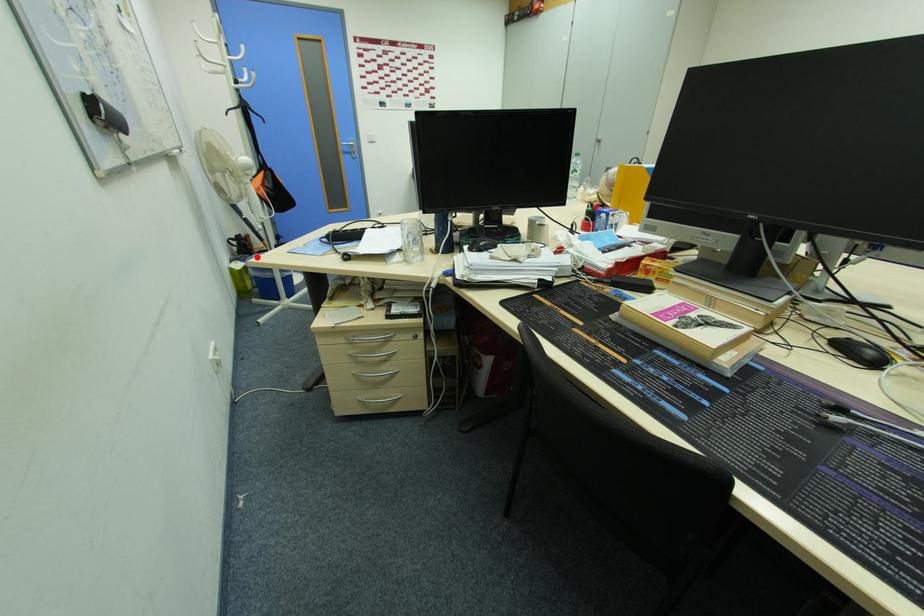
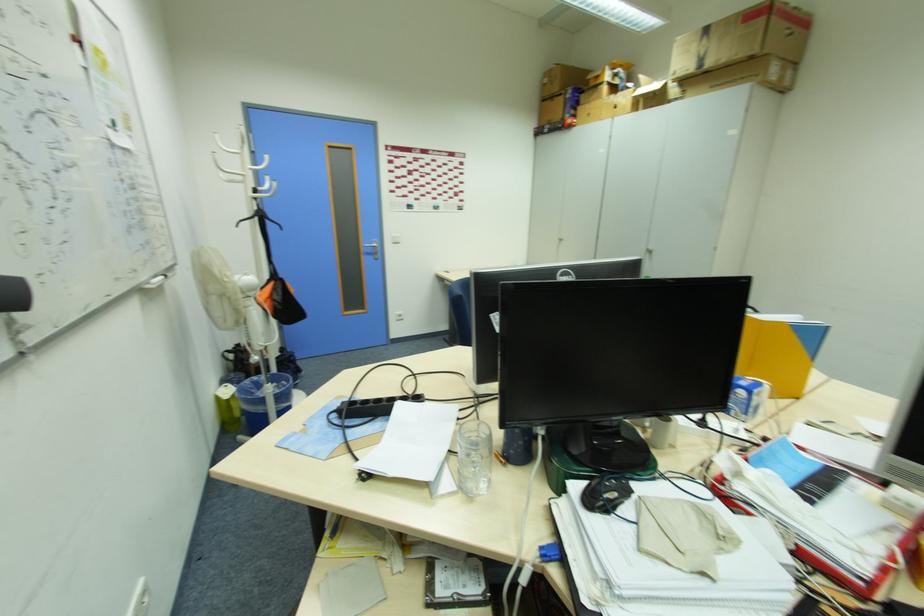
In the second image, find the point that corresponds to the highlighted location in the first image.

(249, 383)